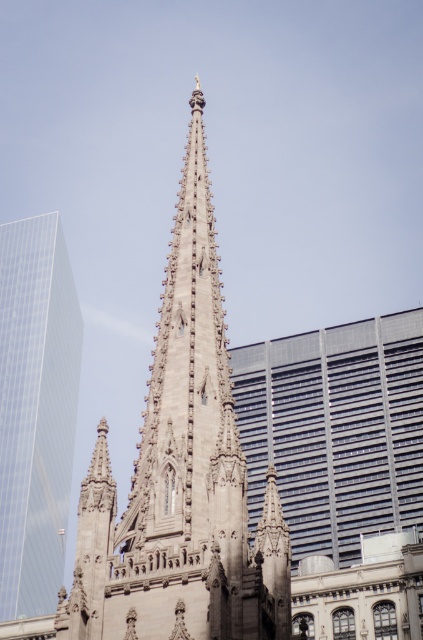
I want to click on brown stone tower at center, so pyautogui.click(x=181, y=476).